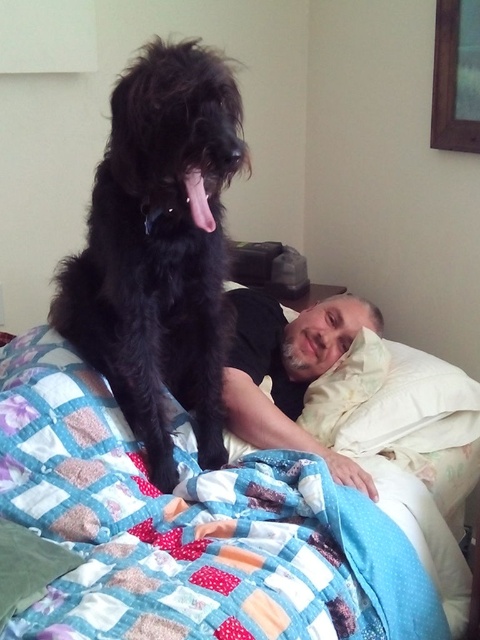
Can you confirm if quilted fabric bed at upper left is shorter than white soft pillow at upper right?

In fact, quilted fabric bed at upper left may be taller than white soft pillow at upper right.

Is point (375, 632) in front of point (385, 362)?

Yes.

Does point (135, 616) come farther from viewer compared to point (441, 384)?

No.

Locate an element on the screen. The image size is (480, 640). quilted fabric bed at upper left is located at coordinates (204, 528).

Can you confirm if black fluffy dog at upper left is positioned to the right of white soft pillow at upper right?

No, black fluffy dog at upper left is not to the right of white soft pillow at upper right.

Can you confirm if black fluffy dog at upper left is wider than white soft pillow at upper right?

Incorrect, black fluffy dog at upper left's width does not surpass white soft pillow at upper right's.

Between point (177, 321) and point (415, 348), which one is positioned in front?

Point (177, 321)

Where is `black fluffy dog at upper left`? The height and width of the screenshot is (640, 480). black fluffy dog at upper left is located at coordinates (159, 250).

Can you confirm if quilted fabric bed at upper left is bigger than black fluffy dog at upper left?

Indeed, quilted fabric bed at upper left has a larger size compared to black fluffy dog at upper left.

Who is shorter, quilted fabric bed at upper left or black fluffy dog at upper left?

With less height is quilted fabric bed at upper left.

The image size is (480, 640). What do you see at coordinates (204, 528) in the screenshot?
I see `quilted fabric bed at upper left` at bounding box center [204, 528].

Identify the location of quilted fabric bed at upper left. The image size is (480, 640). (204, 528).